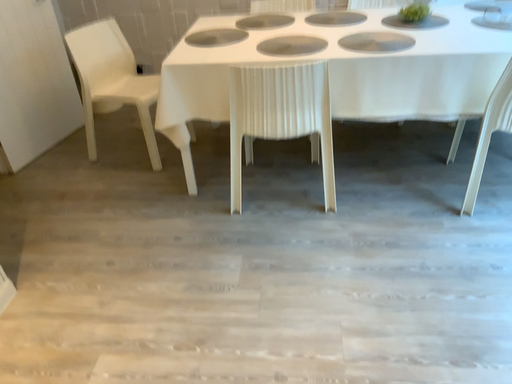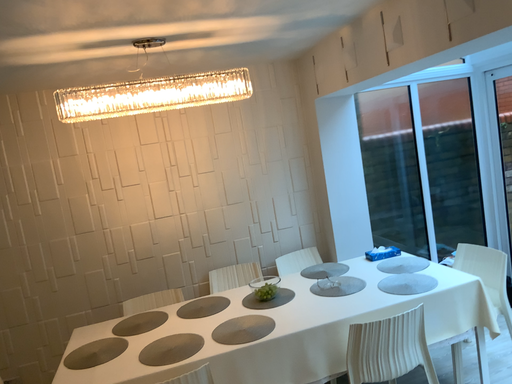
Question: How did the camera likely rotate when shooting the video?

Choices:
 (A) rotated downward
 (B) rotated upward

Answer: (B)